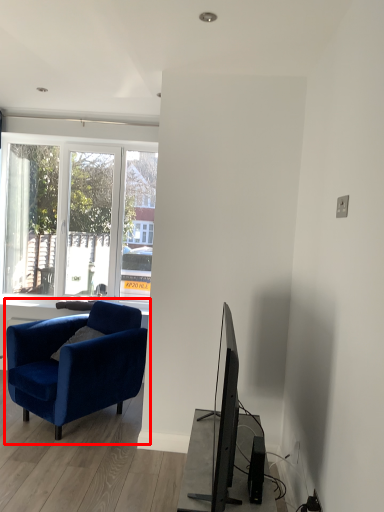
Question: Considering the relative positions of chair (annotated by the red box) and speaker in the image provided, where is chair (annotated by the red box) located with respect to the staircase?

Choices:
 (A) left
 (B) right

Answer: (A)